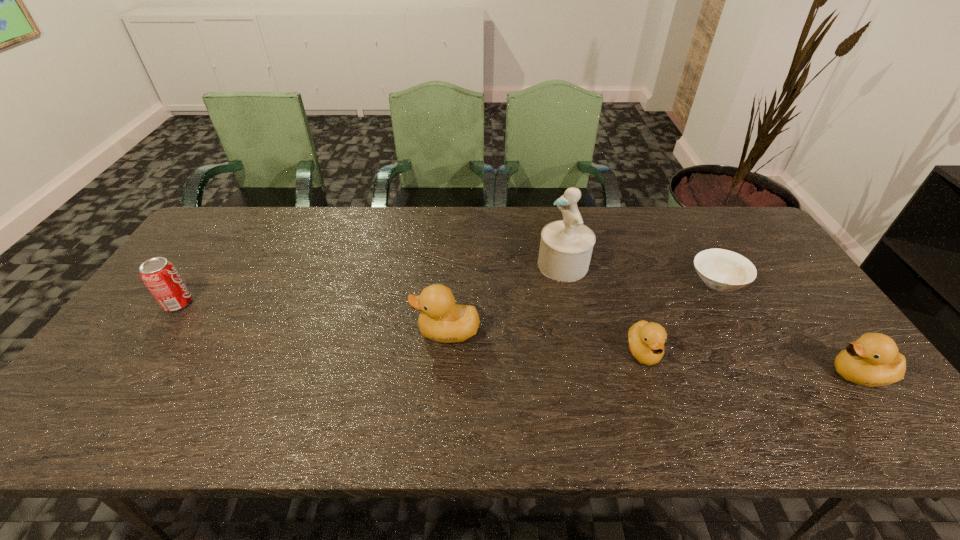
In the image, there is a desktop. Find the location of `vacant area at the near left corner`. vacant area at the near left corner is located at coordinates (155, 376).

The width and height of the screenshot is (960, 540). In the image, there is a desktop. Find the location of `vacant space at the near right corner`. vacant space at the near right corner is located at coordinates (833, 369).

Find the location of `vacant space that is in between the figurine and the fifth tallest object`. vacant space that is in between the figurine and the fifth tallest object is located at coordinates (604, 308).

Identify the location of free spot between the soda can and the leftmost duckling. (312, 318).

At what (x,y) coordinates should I click in order to perform the action: click on blank region between the bowl and the rightmost object. Please return your answer as a coordinate pair (x, y). Looking at the image, I should click on (788, 328).

The image size is (960, 540). Find the location of `unoccupied position between the third object from right to left and the second object from right to left`. unoccupied position between the third object from right to left and the second object from right to left is located at coordinates (681, 317).

The width and height of the screenshot is (960, 540). What are the coordinates of `vacant area that lies between the shortest duckling and the leftmost object` in the screenshot? It's located at (411, 328).

You are a GUI agent. You are given a task and a screenshot of the screen. Output one action in this format:
    pyautogui.click(x=<x>, y=<y>)
    Task: Click on the free space between the shortest duckling and the tallest object
    Image resolution: width=960 pixels, height=540 pixels.
    Given the screenshot: What is the action you would take?
    pyautogui.click(x=604, y=308)

This screenshot has width=960, height=540. Find the location of `vacant point located between the third object from right to left and the second shortest duckling`. vacant point located between the third object from right to left and the second shortest duckling is located at coordinates (751, 363).

Identify the location of free space between the fourth object from right to left and the rightmost duckling. The image size is (960, 540). (711, 320).